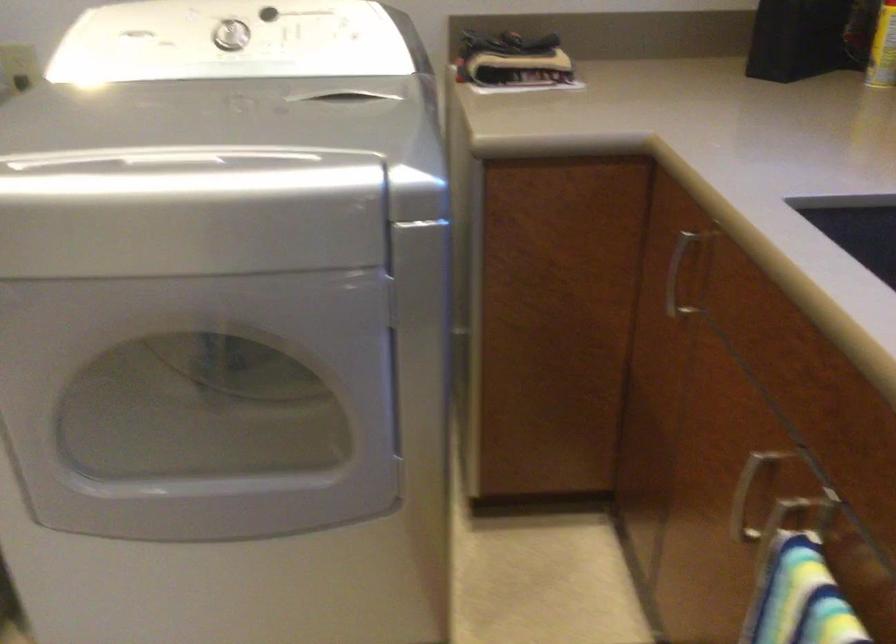
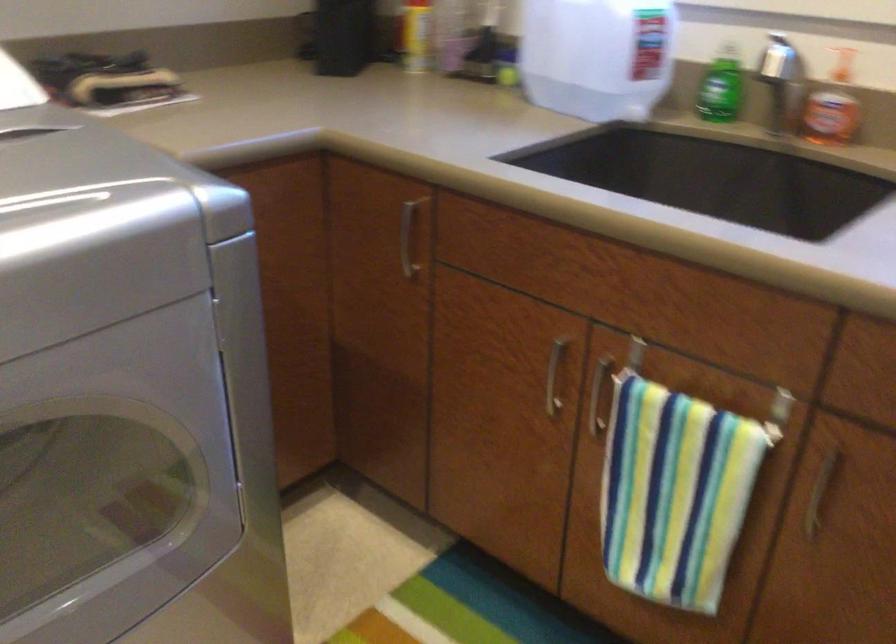
Question: The camera is either moving clockwise (left) or counter-clockwise (right) around the object. The first image is from the beginning of the video and the second image is from the end. Is the camera moving left or right when shooting the video?

Choices:
 (A) Left
 (B) Right

Answer: (A)